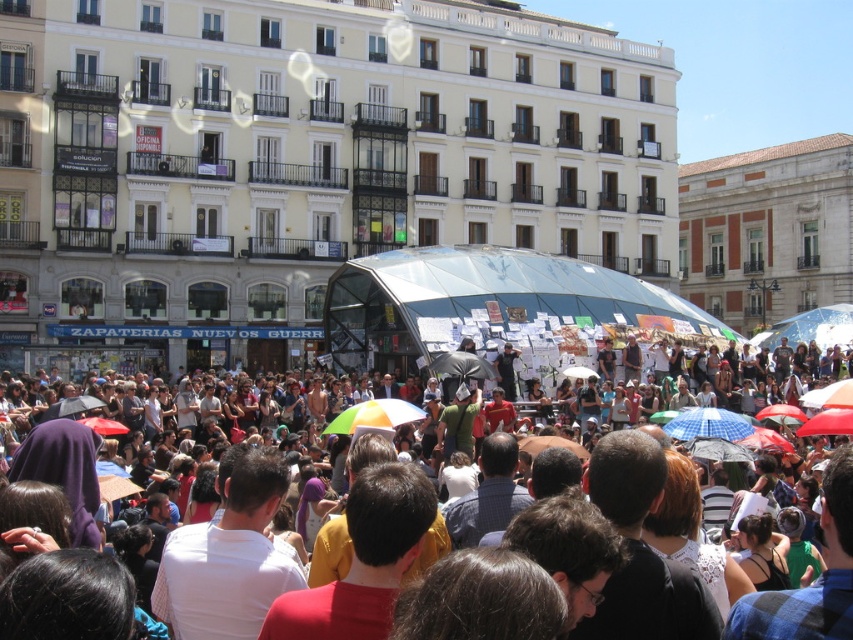
Question: Among these objects, which one is farthest from the camera?

Choices:
 (A) blue checkered umbrella at center
 (B) multicolored fabric umbrella at center

Answer: (A)

Question: Is blue checkered umbrella at center positioned behind multicolored fabric umbrella at center?

Choices:
 (A) no
 (B) yes

Answer: (B)

Question: Does blue checkered umbrella at center have a larger size compared to multicolored fabric umbrella at center?

Choices:
 (A) no
 (B) yes

Answer: (A)

Question: Which of the following is the farthest from the observer?

Choices:
 (A) multicolored umbrellas at center
 (B) blue checkered umbrella at center
 (C) multicolored fabric umbrella at center

Answer: (B)

Question: Is multicolored umbrellas at center to the left of blue checkered umbrella at center from the viewer's perspective?

Choices:
 (A) no
 (B) yes

Answer: (B)

Question: Estimate the real-world distances between objects in this image. Which object is farther from the blue checkered umbrella at center?

Choices:
 (A) multicolored fabric umbrella at center
 (B) multicolored umbrellas at center

Answer: (B)